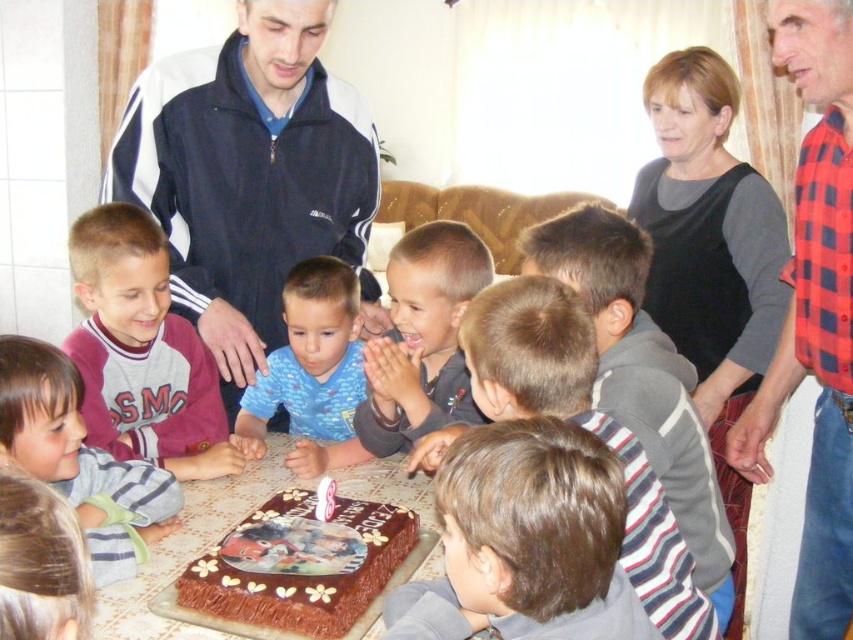
Question: Does red plaid shirt at right have a larger size compared to chocolate frosted cake at center?

Choices:
 (A) yes
 (B) no

Answer: (A)

Question: Among these points, which one is nearest to the camera?

Choices:
 (A) (372, 282)
 (B) (128, 419)
 (C) (583, 630)

Answer: (C)

Question: Which of these objects is positioned farthest from the gray fleece shirt at lower left?

Choices:
 (A) gray fleece sweatshirt at lower left
 (B) chocolatesmoothcake at center

Answer: (A)

Question: Is chocolatesmoothcake at center to the left of brown matte cake at center from the viewer's perspective?

Choices:
 (A) no
 (B) yes

Answer: (B)

Question: Considering the real-world distances, which object is closest to the brown hair at lower center?

Choices:
 (A) gray fleece shirt at lower left
 (B) red plaid shirt at right
 (C) chocolatesmoothcake at center

Answer: (C)

Question: Where is gray fleece sweatshirt at lower left located in relation to gray fleece shirt at lower left in the image?

Choices:
 (A) right
 (B) left

Answer: (B)